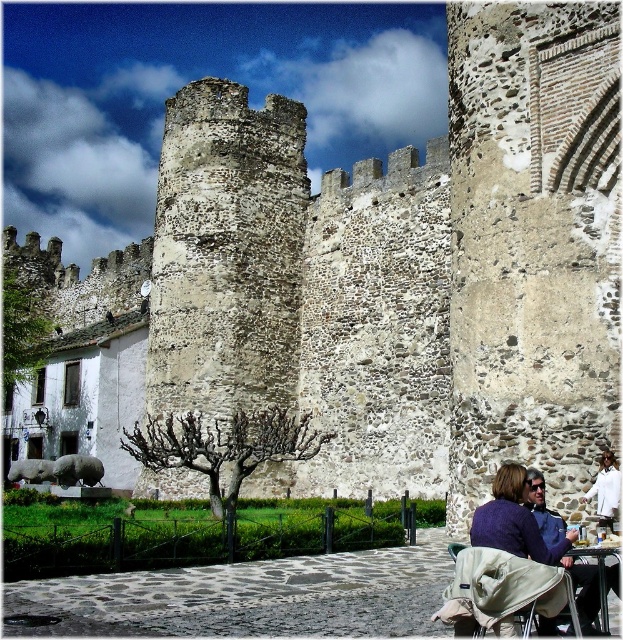
You are a parent with a child in a stroller and you want to move from the castle entrance to the picnic area near the metallic silver table at lower right. Can you maneuver the beige fabric stroller at lower right through the space between them?

The beige fabric stroller at lower right occupies less space than the metallic silver table at lower right, so yes, you can maneuver the beige fabric stroller at lower right through the space between them since it is smaller in size.

You are a parent visiting the historic stone structure with your child. You have a beige fabric stroller at lower right and a purple woolen sweater at lower right. Which item is taller?

The beige fabric stroller at lower right is taller than the purple woolen sweater at lower right.

You are a parent visiting the historic stone structure with your child. You have a beige fabric stroller at lower right and a metallic silver table at lower right nearby. Can you place the stroller on the table?

The beige fabric stroller at lower right is positioned over metallic silver table at lower right, meaning the stroller is already placed on the table.